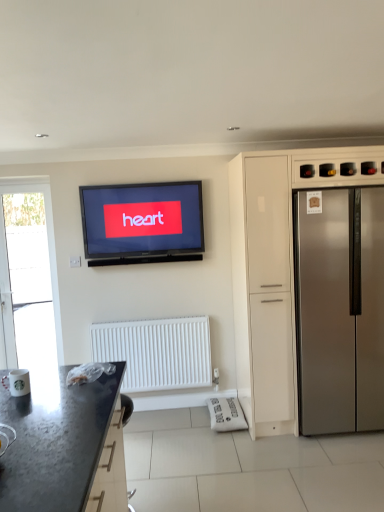
The width and height of the screenshot is (384, 512). Identify the location of vacant space situated above matte black television at upper center (from a real-world perspective). (149, 178).